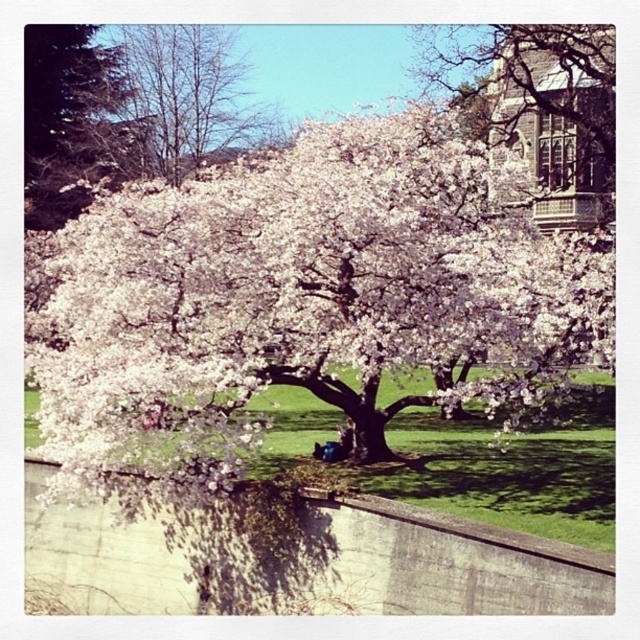
From the picture: You are an artist sketching the scene. You notice the white blossoms at center and the bare branches at upper left. Which object is closer to the ground?

The white blossoms at center are closer to the ground because they are positioned under the bare branches at upper left.

You are an artist sketching the scene. You notice the white blossoms at center and the bare branches at upper left. Which object would require more paper space due to its size?

The white blossoms at center would require more paper space because they are bigger than the bare branches at upper left.